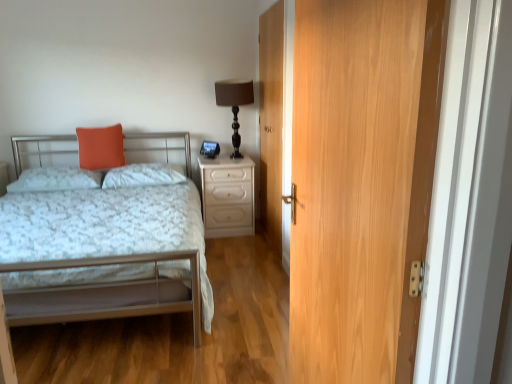
Question: Is white fluffy pillow at center, the 2th pillow viewed from the left, positioned in front of matte black table lamp at upper center?

Choices:
 (A) yes
 (B) no

Answer: (A)

Question: Is white fluffy pillow at center, the 2th pillow viewed from the left, next to matte black table lamp at upper center?

Choices:
 (A) no
 (B) yes

Answer: (A)

Question: Does white fluffy pillow at center, the 2th pillow viewed from the left, have a larger size compared to matte black table lamp at upper center?

Choices:
 (A) no
 (B) yes

Answer: (A)

Question: From the image's perspective, is white fluffy pillow at center, the 2th pillow viewed from the left, over matte black table lamp at upper center?

Choices:
 (A) yes
 (B) no

Answer: (B)

Question: Is white fluffy pillow at center, the 2th pillow viewed from the left, not close to matte black table lamp at upper center?

Choices:
 (A) yes
 (B) no

Answer: (B)

Question: Considering the relative positions of white fluffy pillow at center, which is the first pillow in right-to-left order, and matte black table lamp at upper center in the image provided, is white fluffy pillow at center, which is the first pillow in right-to-left order, to the right of matte black table lamp at upper center from the viewer's perspective?

Choices:
 (A) yes
 (B) no

Answer: (B)

Question: Is white fluffy pillow at center, the 2th pillow viewed from the left, taller than orange matte pillow at upper left?

Choices:
 (A) yes
 (B) no

Answer: (B)

Question: Does white fluffy pillow at center, the 2th pillow viewed from the left, have a larger size compared to orange matte pillow at upper left?

Choices:
 (A) yes
 (B) no

Answer: (A)

Question: Is white fluffy pillow at center, which is the first pillow in right-to-left order, positioned before orange matte pillow at upper left?

Choices:
 (A) yes
 (B) no

Answer: (A)

Question: Considering the relative sizes of white fluffy pillow at center, which is the first pillow in right-to-left order, and orange matte pillow at upper left in the image provided, is white fluffy pillow at center, which is the first pillow in right-to-left order, smaller than orange matte pillow at upper left?

Choices:
 (A) yes
 (B) no

Answer: (B)

Question: Would you say white fluffy pillow at center, which is the first pillow in right-to-left order, is outside orange matte pillow at upper left?

Choices:
 (A) no
 (B) yes

Answer: (B)

Question: Can you confirm if white fluffy pillow at center, the 2th pillow viewed from the left, is positioned to the right of orange matte pillow at upper left?

Choices:
 (A) yes
 (B) no

Answer: (A)

Question: From a real-world perspective, does wooden door at center, placed as the 2th door when sorted from front to back, stand above metallic silver bed at left?

Choices:
 (A) no
 (B) yes

Answer: (B)